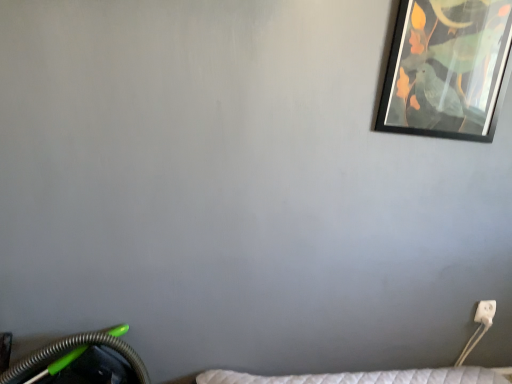
The image size is (512, 384). Describe the element at coordinates (485, 310) in the screenshot. I see `white plastic electric outlet at lower right` at that location.

Image resolution: width=512 pixels, height=384 pixels. I want to click on white plastic electric outlet at lower right, so click(x=485, y=310).

Describe the element at coordinates (446, 69) in the screenshot. This screenshot has width=512, height=384. I see `black matte picture frame at upper right` at that location.

Measure the distance between black matte picture frame at upper right and camera.

They are 1.28 meters apart.

Image resolution: width=512 pixels, height=384 pixels. What are the coordinates of `black matte picture frame at upper right` in the screenshot? It's located at (446, 69).

You are a GUI agent. You are given a task and a screenshot of the screen. Output one action in this format:
    pyautogui.click(x=<x>, y=<y>)
    Task: Click on the white plastic electric outlet at lower right
    The image size is (512, 384).
    Given the screenshot: What is the action you would take?
    pyautogui.click(x=485, y=310)

Is black matte picture frame at upper right to the left of white plastic electric outlet at lower right from the viewer's perspective?

Yes.

Who is more distant, black matte picture frame at upper right or white plastic electric outlet at lower right?

white plastic electric outlet at lower right is further from the camera.

Considering the points (448, 122) and (482, 311), which point is in front, point (448, 122) or point (482, 311)?

Point (448, 122)

From the picture: From the image's perspective, is black matte picture frame at upper right on white plastic electric outlet at lower right?

Yes, from the image's perspective, black matte picture frame at upper right is on top of white plastic electric outlet at lower right.

From a real-world perspective, which is physically above, black matte picture frame at upper right or white plastic electric outlet at lower right?

black matte picture frame at upper right, from a real-world perspective.

Which of these two, black matte picture frame at upper right or white plastic electric outlet at lower right, is wider?

With larger width is black matte picture frame at upper right.

Between black matte picture frame at upper right and white plastic electric outlet at lower right, which one has less height?

white plastic electric outlet at lower right is shorter.

Based on the photo, is black matte picture frame at upper right bigger or smaller than white plastic electric outlet at lower right?

black matte picture frame at upper right is bigger than white plastic electric outlet at lower right.

Is black matte picture frame at upper right not within white plastic electric outlet at lower right?

black matte picture frame at upper right is positioned outside white plastic electric outlet at lower right.

Is the surface of black matte picture frame at upper right in direct contact with white plastic electric outlet at lower right?

No, black matte picture frame at upper right is not making contact with white plastic electric outlet at lower right.

Could you tell me if black matte picture frame at upper right is turned towards white plastic electric outlet at lower right?

No, black matte picture frame at upper right is not turned towards white plastic electric outlet at lower right.

How different are the orientations of black matte picture frame at upper right and white plastic electric outlet at lower right in degrees?

The angular difference between black matte picture frame at upper right and white plastic electric outlet at lower right is 1.97 degrees.

Locate an element on the screen. This screenshot has width=512, height=384. electric outlet behind the black matte picture frame at upper right is located at coordinates (485, 310).

Based on their positions, is white plastic electric outlet at lower right located to the left or right of black matte picture frame at upper right?

Based on their positions, white plastic electric outlet at lower right is located to the right of black matte picture frame at upper right.

Relative to black matte picture frame at upper right, is white plastic electric outlet at lower right in front or behind?

white plastic electric outlet at lower right is behind black matte picture frame at upper right.

Which is nearer, (493, 314) or (412, 31)?

Point (493, 314) is positioned farther from the camera compared to point (412, 31).

From the image's perspective, who appears lower, white plastic electric outlet at lower right or black matte picture frame at upper right?

From the image's view, white plastic electric outlet at lower right is below.

From the picture: From a real-world perspective, is white plastic electric outlet at lower right located beneath black matte picture frame at upper right?

Yes, from a real-world perspective, white plastic electric outlet at lower right is beneath black matte picture frame at upper right.

Between white plastic electric outlet at lower right and black matte picture frame at upper right, which one has larger width?

With larger width is black matte picture frame at upper right.

Who is shorter, white plastic electric outlet at lower right or black matte picture frame at upper right?

With less height is white plastic electric outlet at lower right.

Considering the sizes of objects white plastic electric outlet at lower right and black matte picture frame at upper right in the image provided, who is smaller, white plastic electric outlet at lower right or black matte picture frame at upper right?

Smaller between the two is white plastic electric outlet at lower right.

Is white plastic electric outlet at lower right completely or partially outside of black matte picture frame at upper right?

Yes, white plastic electric outlet at lower right is located beyond the bounds of black matte picture frame at upper right.

Are white plastic electric outlet at lower right and black matte picture frame at upper right making contact?

No, white plastic electric outlet at lower right is not in contact with black matte picture frame at upper right.

Is white plastic electric outlet at lower right oriented towards black matte picture frame at upper right?

No, white plastic electric outlet at lower right is not oriented towards black matte picture frame at upper right.

How many degrees apart are the facing directions of white plastic electric outlet at lower right and black matte picture frame at upper right?

The facing directions of white plastic electric outlet at lower right and black matte picture frame at upper right are 1.97 degrees apart.

Measure the distance from white plastic electric outlet at lower right to black matte picture frame at upper right.

The distance of white plastic electric outlet at lower right from black matte picture frame at upper right is 34.75 inches.

The width and height of the screenshot is (512, 384). I want to click on picture frame above the white plastic electric outlet at lower right (from the image's perspective), so click(446, 69).

You are a GUI agent. You are given a task and a screenshot of the screen. Output one action in this format:
    pyautogui.click(x=<x>, y=<y>)
    Task: Click on the electric outlet below the black matte picture frame at upper right (from the image's perspective)
    This screenshot has height=384, width=512.
    Given the screenshot: What is the action you would take?
    pyautogui.click(x=485, y=310)

Image resolution: width=512 pixels, height=384 pixels. I want to click on picture frame positioned vertically above the white plastic electric outlet at lower right (from a real-world perspective), so click(x=446, y=69).